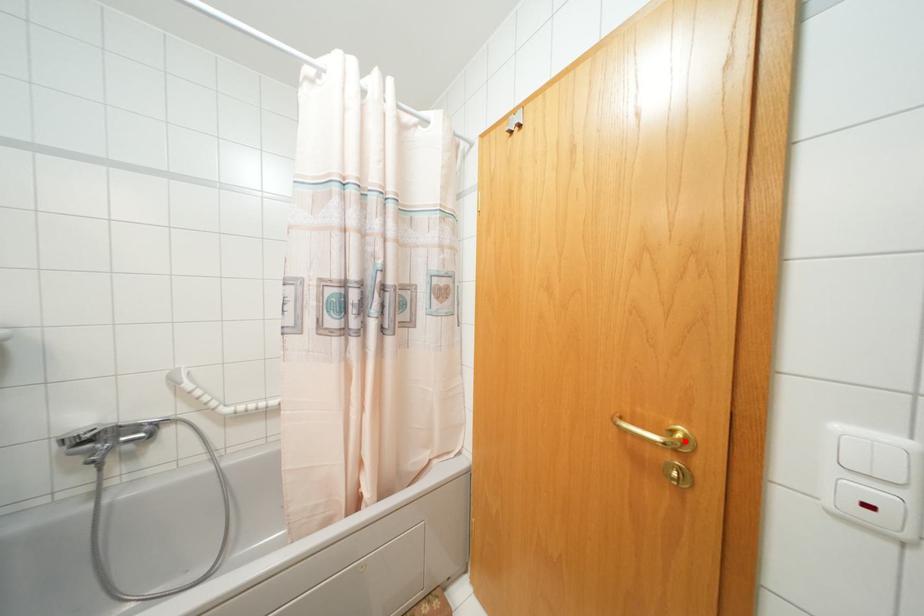
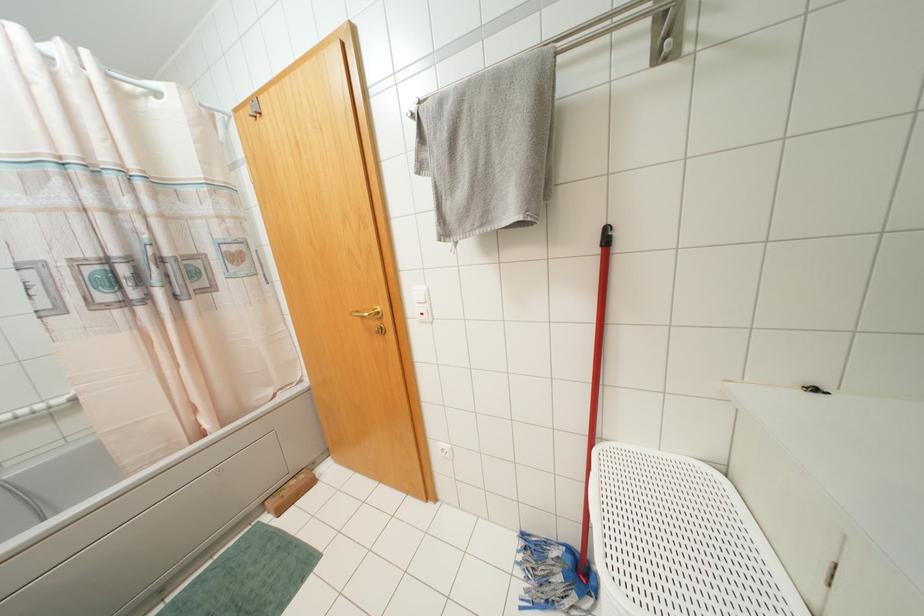
Find the pixel in the second image that matches the highlighted location in the first image.

(378, 312)